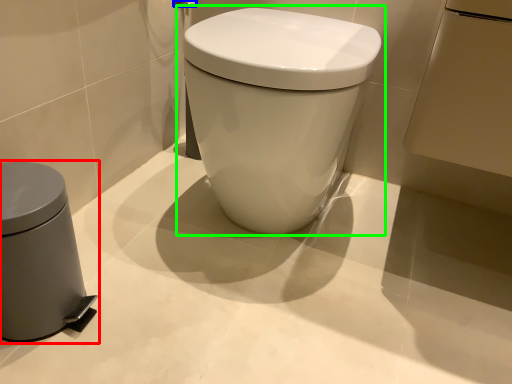
Question: Based on their relative distances, which object is nearer to waste container (highlighted by a red box)? Choose from towel bar (highlighted by a blue box) and toilet (highlighted by a green box).

Choices:
 (A) towel bar
 (B) toilet

Answer: (B)